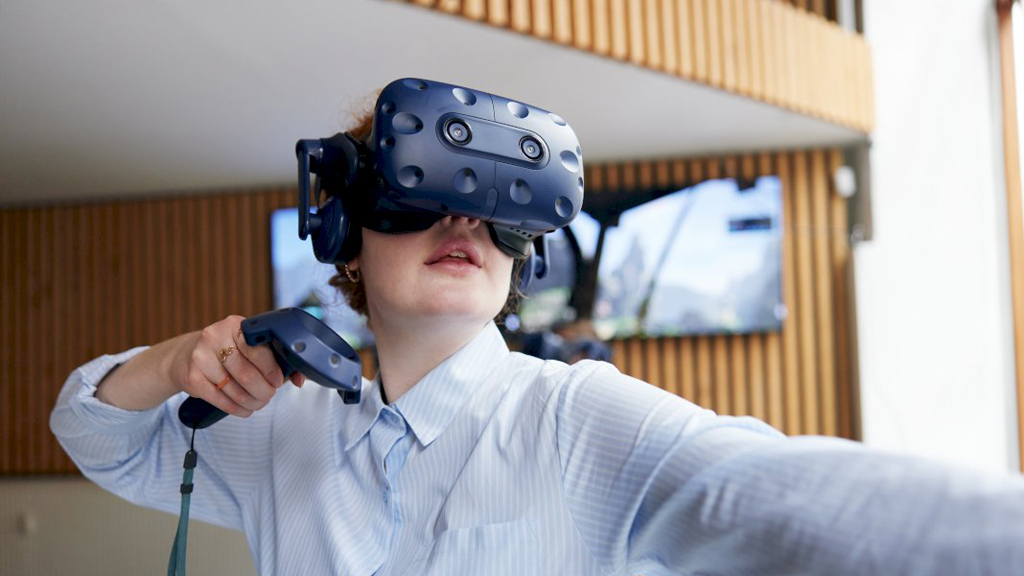
Find the location of a particular element. The height and width of the screenshot is (576, 1024). wall is located at coordinates (926, 230).